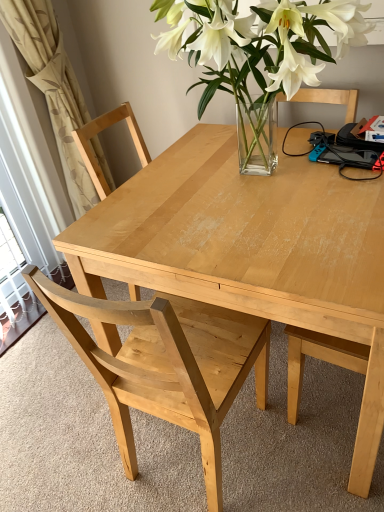
The width and height of the screenshot is (384, 512). I want to click on vacant space underneath light wood chair at center (from a real-world perspective), so click(x=183, y=463).